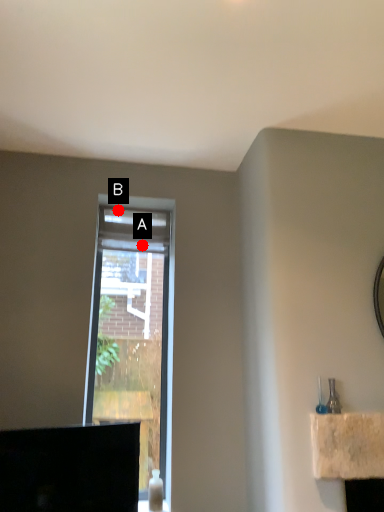
Question: Two points are circled on the image, labeled by A and B beside each circle. Among these points, which one is farthest from the camera?

Choices:
 (A) A is further
 (B) B is further

Answer: (B)